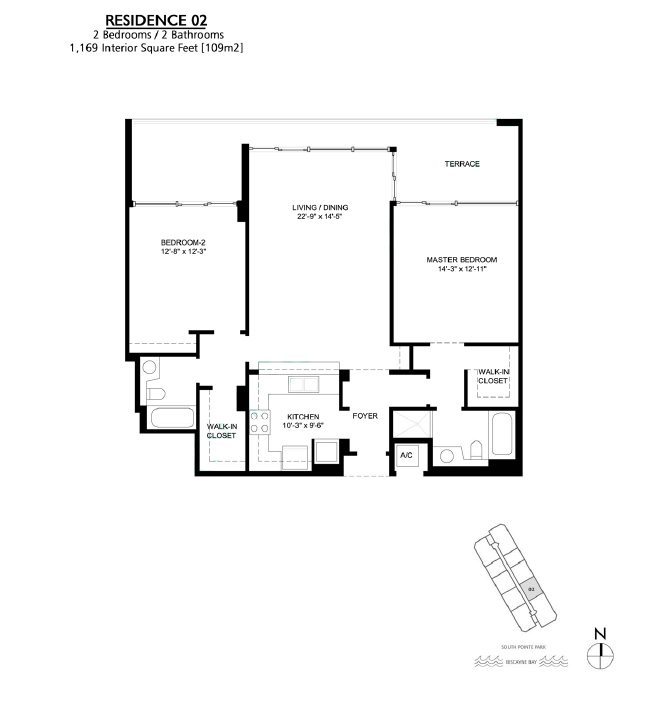
At what (x,y) coordinates should I click in order to perform the action: click on floor plan. Please return your answer as a coordinate pair (x, y). Looking at the image, I should click on (480, 326).